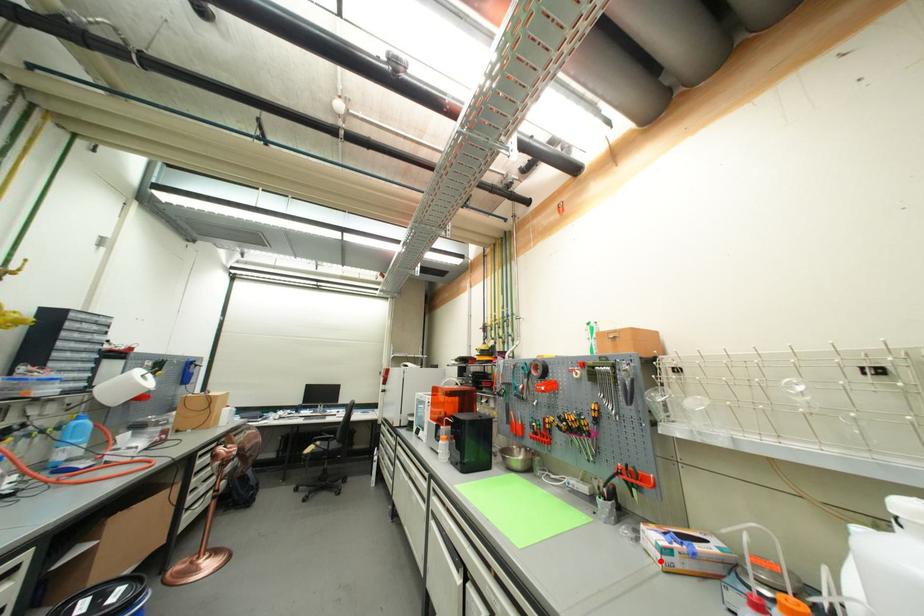
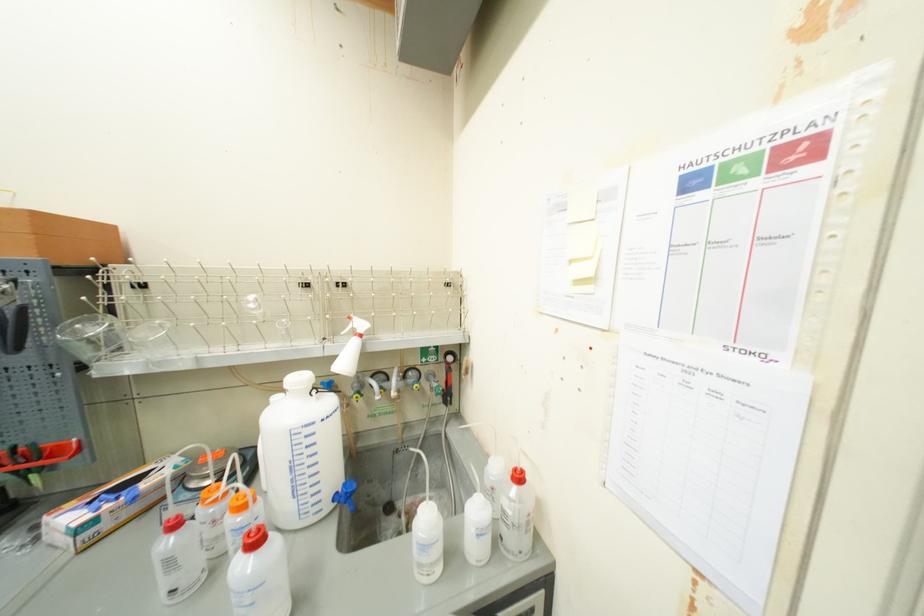
Where in the second image is the point corresponding to the highlighted location from the first image?

(69, 551)